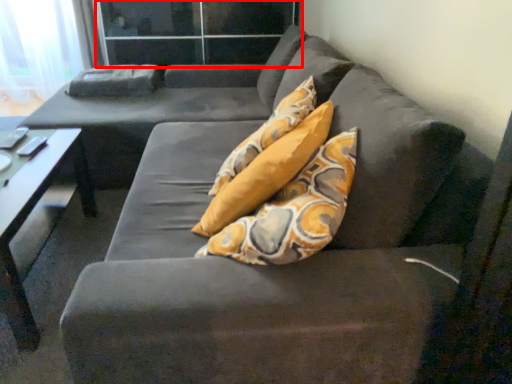
Question: From the image's perspective, where is glass door (annotated by the red box) located in relation to table in the image?

Choices:
 (A) above
 (B) below

Answer: (A)